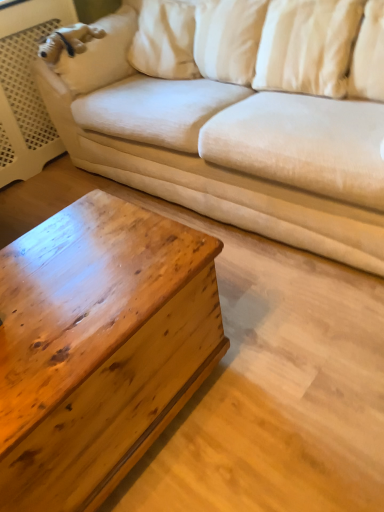
Question: From a real-world perspective, is white soft pillow at upper right, the first pillow viewed from the right, positioned above or below wooden chestnut coffee table at lower left?

Choices:
 (A) above
 (B) below

Answer: (A)

Question: From the image's perspective, relative to wooden chestnut coffee table at lower left, is white soft pillow at upper right, the first pillow viewed from the right, above or below?

Choices:
 (A) above
 (B) below

Answer: (A)

Question: Estimate the real-world distances between objects in this image. Which object is closer to the beige fabric couch at upper center?

Choices:
 (A) white soft pillow at upper right, the first pillow viewed from the right
 (B) wooden chestnut coffee table at lower left
 (C) white soft pillow at upper right, which appears as the 1th pillow when viewed from the left

Answer: (C)

Question: Estimate the real-world distances between objects in this image. Which object is farther from the wooden chestnut coffee table at lower left?

Choices:
 (A) white soft pillow at upper right, the first pillow viewed from the right
 (B) white soft pillow at upper right, which appears as the 1th pillow when viewed from the left
 (C) beige fabric couch at upper center

Answer: (A)